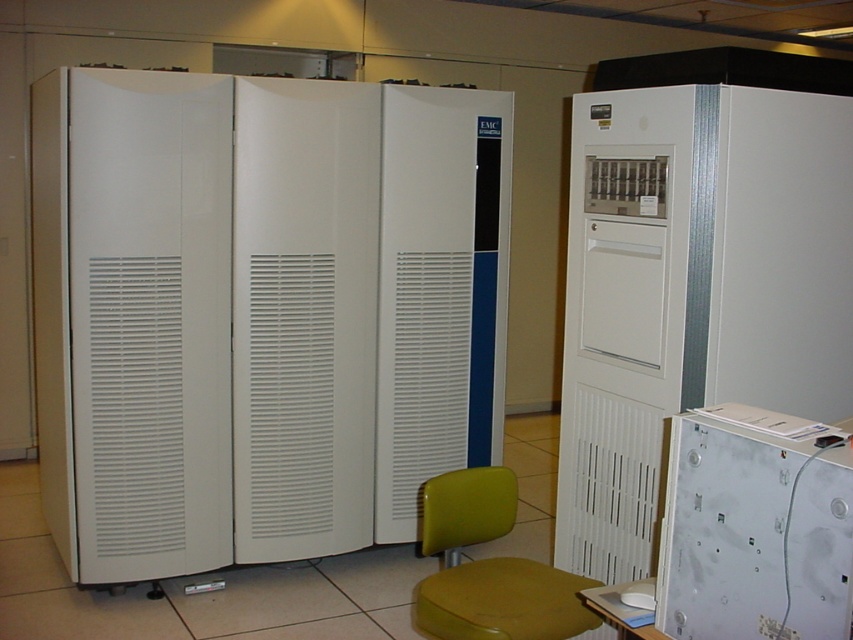
Question: Is white plastic cabinet at lower right to the right of green plastic chair at center from the viewer's perspective?

Choices:
 (A) yes
 (B) no

Answer: (A)

Question: Observing the image, what is the correct spatial positioning of white plastic cabinet at lower right in reference to green plastic chair at center?

Choices:
 (A) right
 (B) left

Answer: (A)

Question: Which point is farther to the camera?

Choices:
 (A) (827, 627)
 (B) (471, 522)

Answer: (B)

Question: Is green plastic chair at center to the right of yellow plastic stool at center from the viewer's perspective?

Choices:
 (A) yes
 (B) no

Answer: (B)

Question: Which of these objects is positioned farthest from the white plastic cabinet at lower right?

Choices:
 (A) green plastic chair at center
 (B) white matte refrigerator at center

Answer: (B)

Question: Considering the real-world distances, which object is farthest from the yellow plastic stool at center?

Choices:
 (A) white matte refrigerator at center
 (B) green plastic chair at center
 (C) white plastic cabinet at lower right

Answer: (A)